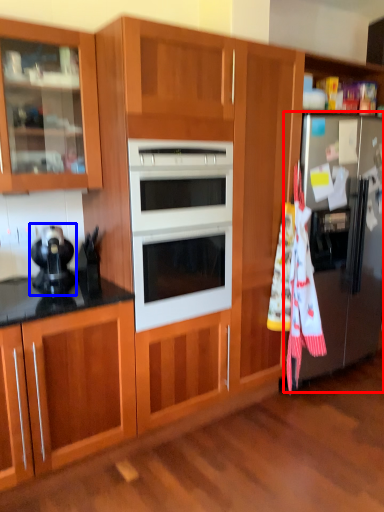
Question: Among these objects, which one is nearest to the camera, refrigerator (highlighted by a red box) or appliance (highlighted by a blue box)?

Choices:
 (A) refrigerator
 (B) appliance

Answer: (B)